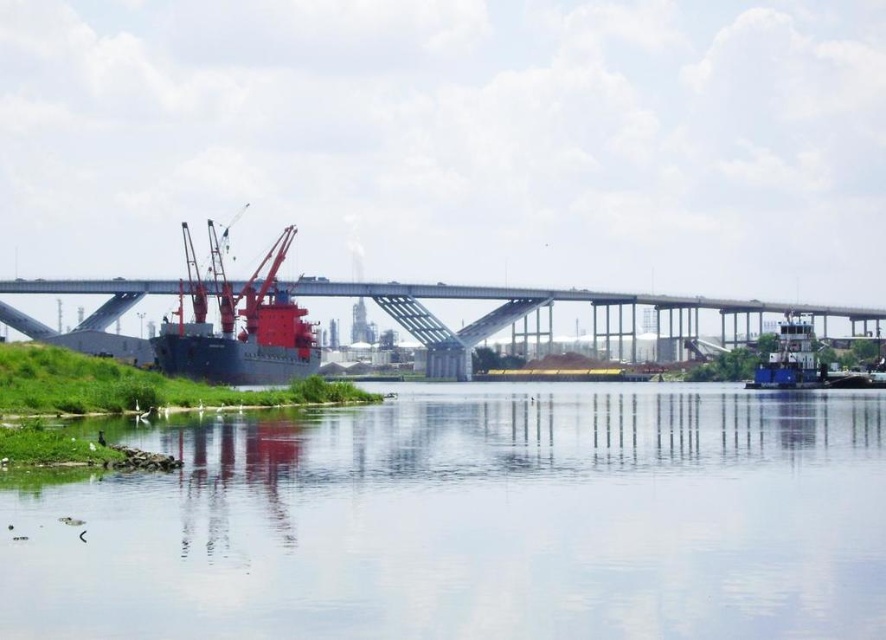
Question: Is clear water at center smaller than metallic blue cargo ship at center?

Choices:
 (A) no
 (B) yes

Answer: (B)

Question: Which object appears farthest from the camera in this image?

Choices:
 (A) clear water at center
 (B) metallic gray bridge at center
 (C) metallic blue cargo ship at center

Answer: (B)

Question: Is clear water at center positioned in front of metallic blue cargo ship at center?

Choices:
 (A) yes
 (B) no

Answer: (A)

Question: Based on their relative distances, which object is farther from the clear water at center?

Choices:
 (A) metallic gray bridge at center
 (B) metallic blue cargo ship at center

Answer: (A)

Question: Can you confirm if metallic gray bridge at center is thinner than metallic blue cargo ship at center?

Choices:
 (A) yes
 (B) no

Answer: (B)

Question: Estimate the real-world distances between objects in this image. Which object is farther from the metallic blue cargo ship at center?

Choices:
 (A) clear water at center
 (B) metallic gray bridge at center

Answer: (A)